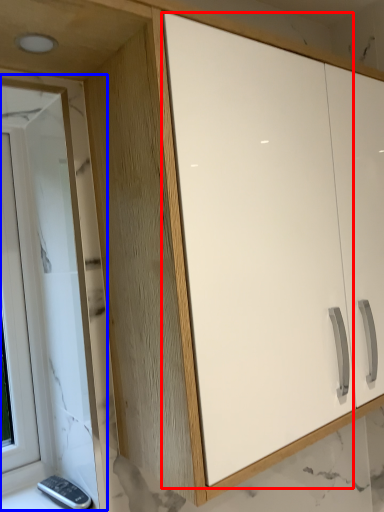
Question: Which point is closer to the camera, screen door (highlighted by a red box) or window (highlighted by a blue box)?

Choices:
 (A) screen door
 (B) window

Answer: (A)